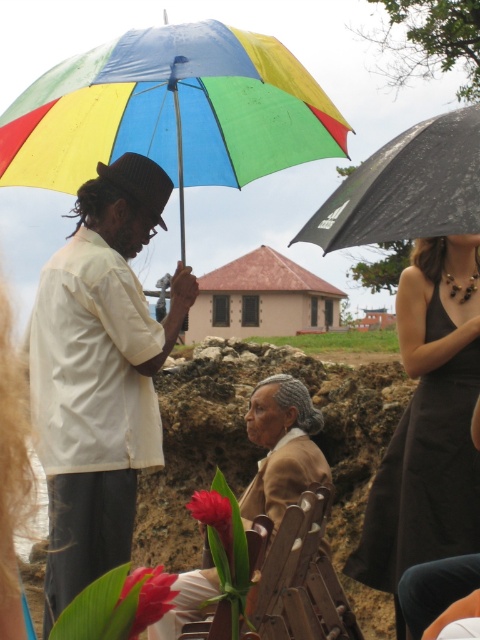
Question: Among these points, which one is farthest from the camera?

Choices:
 (A) (463, 225)
 (B) (85, 321)
 (C) (420, 483)

Answer: (C)

Question: Based on their relative distances, which object is farther from the rainbow fabric umbrella at upper left?

Choices:
 (A) black satin dress at center
 (B) black matte umbrella at upper right

Answer: (B)

Question: Which of the following is the farthest from the observer?

Choices:
 (A) (168, 198)
 (B) (324, 216)
 (C) (78, 100)
 (D) (435, 497)

Answer: (D)

Question: Can you confirm if white matte shirt at center is bigger than rainbow fabric umbrella at upper left?

Choices:
 (A) no
 (B) yes

Answer: (A)

Question: Can you confirm if rainbow fabric umbrella at upper left is positioned to the right of black satin dress at center?

Choices:
 (A) yes
 (B) no

Answer: (B)

Question: Does rainbow fabric umbrella at upper left have a lesser width compared to black satin dress at center?

Choices:
 (A) no
 (B) yes

Answer: (A)